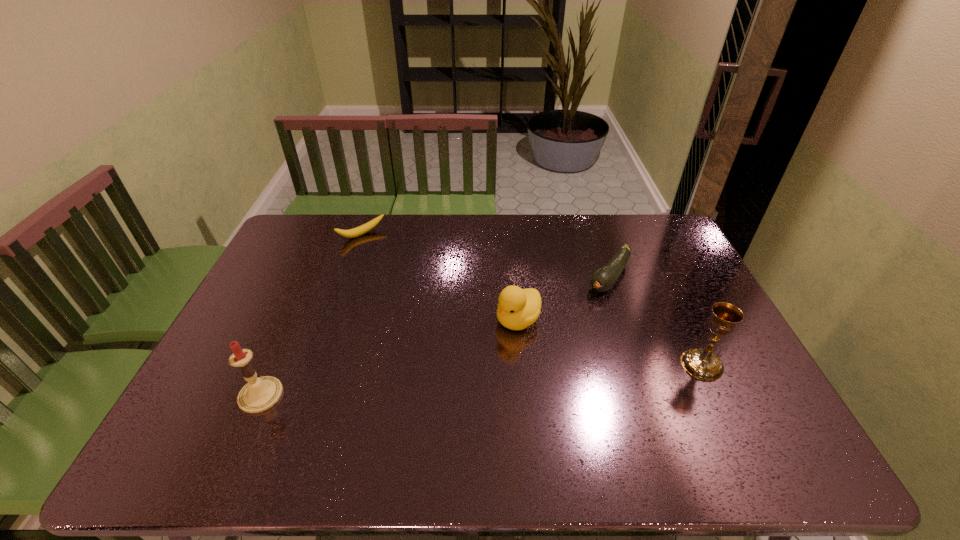
You are a GUI agent. You are given a task and a screenshot of the screen. Output one action in this format:
    pyautogui.click(x=<x>, y=<y>)
    Task: Click on the object that is positioned at the left edge
    
    Given the screenshot: What is the action you would take?
    pyautogui.click(x=260, y=394)

Where is `object situated at the right edge`? The height and width of the screenshot is (540, 960). object situated at the right edge is located at coordinates click(x=703, y=364).

The width and height of the screenshot is (960, 540). I want to click on object present at the near left corner, so click(x=260, y=394).

This screenshot has width=960, height=540. In order to click on vacant area at the far edge of the desktop in this screenshot , I will do `click(353, 221)`.

At what (x,y) coordinates should I click in order to perform the action: click on vacant space at the near edge of the desktop. Please return your answer as a coordinate pair (x, y). This screenshot has height=540, width=960. Looking at the image, I should click on (535, 411).

I want to click on vacant space at the left edge of the desktop, so click(x=253, y=334).

The height and width of the screenshot is (540, 960). Find the location of `free space at the right edge`. free space at the right edge is located at coordinates (670, 320).

At what (x,y) coordinates should I click in order to perform the action: click on vacant space at the far right corner of the desktop. Please return your answer as a coordinate pair (x, y). Looking at the image, I should click on (661, 247).

The image size is (960, 540). What are the coordinates of `free space between the third nearest object and the farthest object` in the screenshot? It's located at (440, 277).

Image resolution: width=960 pixels, height=540 pixels. What are the coordinates of `free area in between the duck and the rightmost object` in the screenshot? It's located at (611, 342).